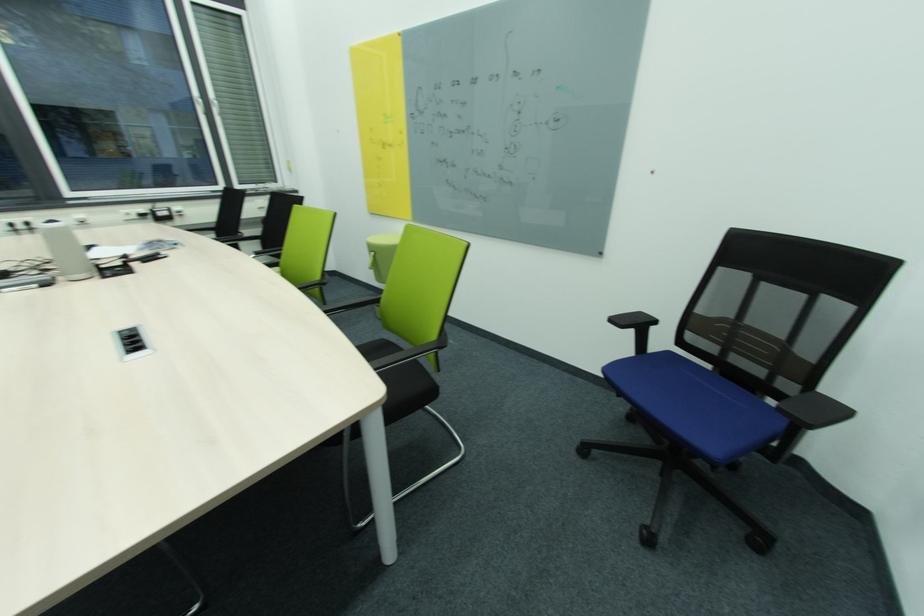
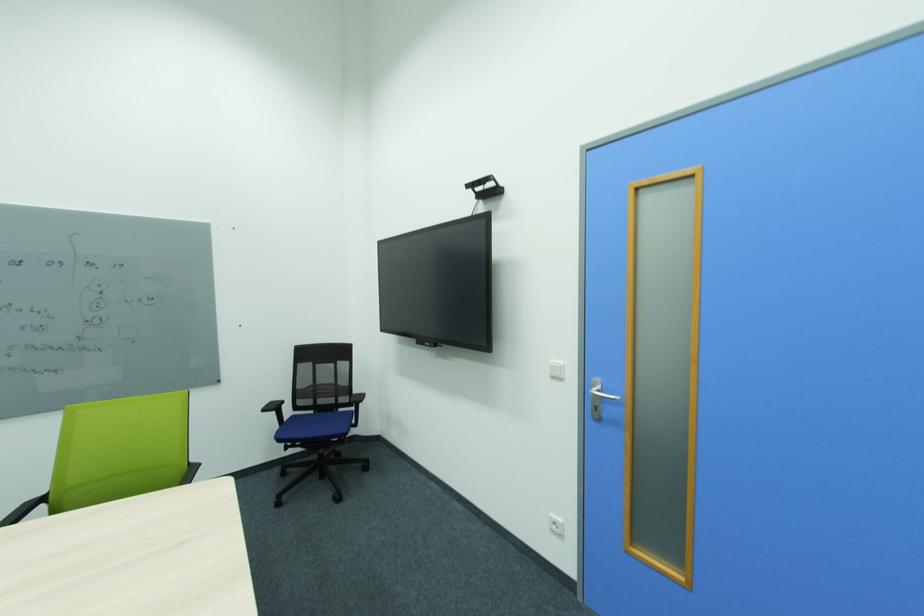
Locate, in the second image, the point that corresponds to [673,354] in the first image.

(297, 418)